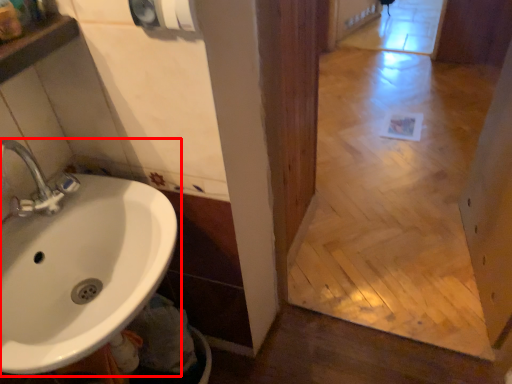
Question: Where is sink (annotated by the red box) located in relation to hand dryer in the image?

Choices:
 (A) right
 (B) left

Answer: (B)